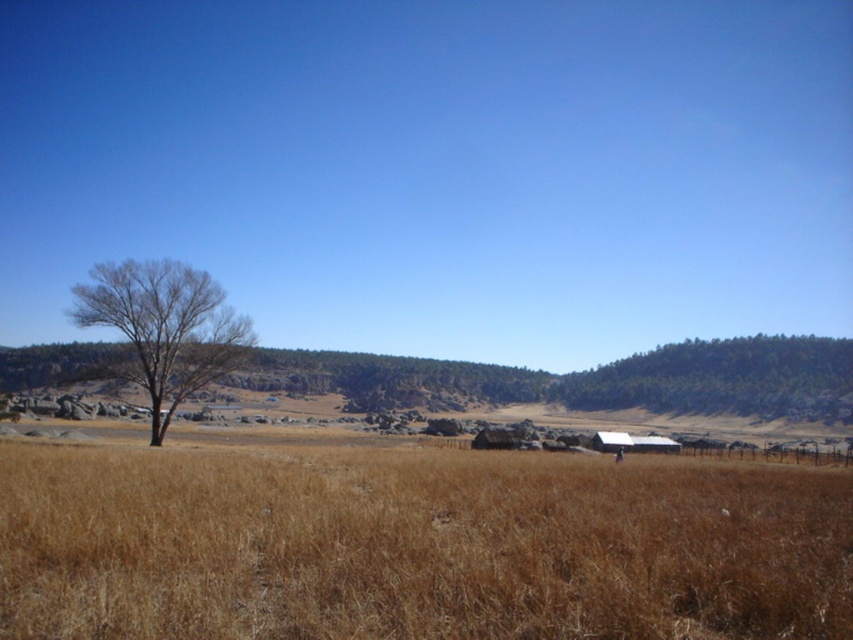
You are standing at the point with coordinates point [160,378] and want to walk towards the point with coordinates point [105,545]. Which direction should you move relative to your current position?

You should move forward because point [105,545] is in front of point [160,378].

You are a hiker who wants to take a photo of the bare wood tree at left without any foreground obstruction. Since you are standing on the brown dry grass at center, can you move backward to get a clear shot of the tree?

The brown dry grass at center is located below the bare wood tree at left, so moving backward might still leave the grass in the foreground. To get a clear shot without obstruction, you would need to position yourself where the grass is not between you and the tree.